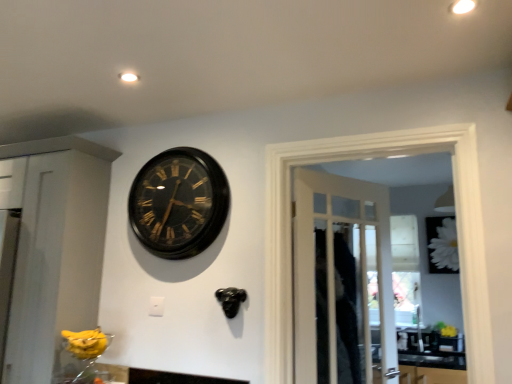
Question: Does point (377, 365) appear closer or farther from the camera than point (140, 233)?

Choices:
 (A) closer
 (B) farther

Answer: (B)

Question: Considering the positions of wooden door at center and black polished wood clock at upper center in the image, is wooden door at center bigger or smaller than black polished wood clock at upper center?

Choices:
 (A) big
 (B) small

Answer: (A)

Question: Considering the real-world distances, which object is closest to the black polished wood clock at upper center?

Choices:
 (A) white glossy sink at lower right
 (B) white matte flower at upper right
 (C) wooden door at center

Answer: (C)

Question: Which of these objects is positioned farthest from the white matte flower at upper right?

Choices:
 (A) white glossy sink at lower right
 (B) black polished wood clock at upper center
 (C) wooden door at center

Answer: (B)